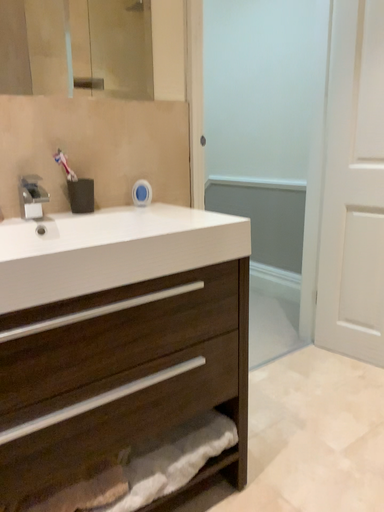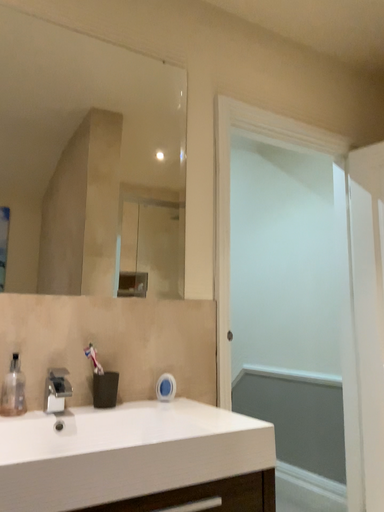
Question: How did the camera likely rotate when shooting the video?

Choices:
 (A) rotated upward
 (B) rotated downward

Answer: (A)